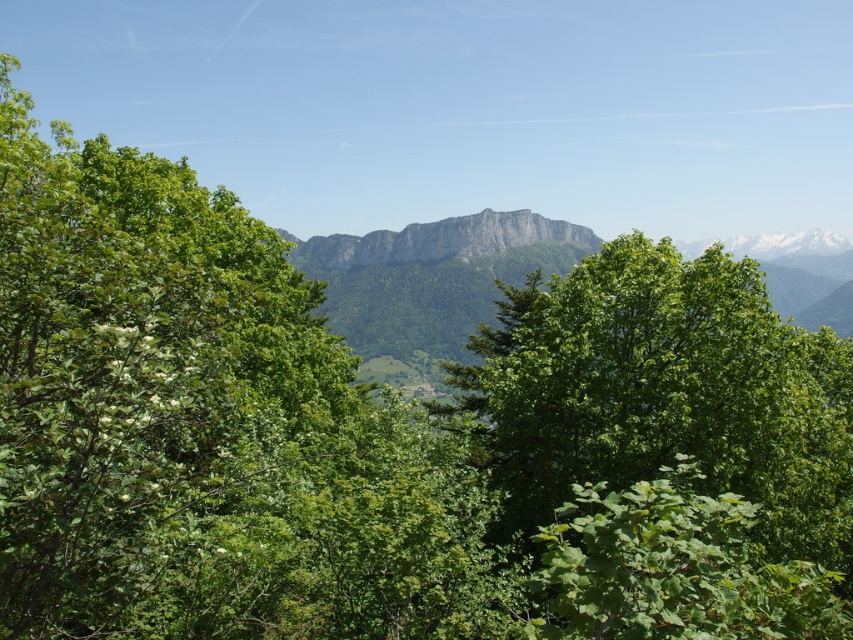
Based on the scene description, which object is larger in size between the green leafy tree at center and the gray rocky mountain range at center?

The gray rocky mountain range at center is larger than the green leafy tree at center.

You are standing at the base of the mountain and want to reach the point marked at coordinates point (x=850, y=474). If you can walk 4 meters per minute, how long will it take you to reach that point?

The distance between you and point (x=850, y=474) is 36.57 meters. At a walking speed of 4 meters per minute, it will take approximately 9.14 minutes to reach the point.

You are standing in the mountain landscape and want to take a photo that includes both the green leafy tree at center and the gray rocky mountain range at center. Which object should you position closer to the front of your photo frame?

You should position the green leafy tree at center closer to the front of your photo frame because it is closer to the viewer than the gray rocky mountain range at center.